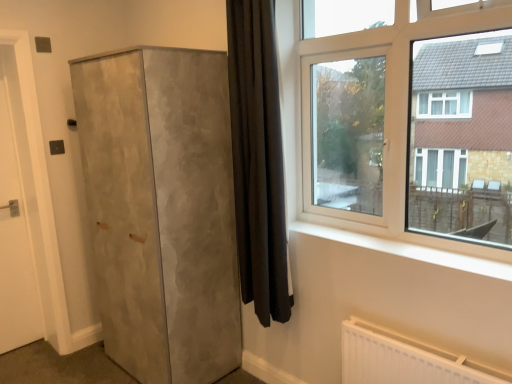
Question: Considering the relative sizes of white matte door at left and matte concrete cupboard at left in the image provided, is white matte door at left thinner than matte concrete cupboard at left?

Choices:
 (A) no
 (B) yes

Answer: (B)

Question: Is white matte door at left to the left of matte concrete cupboard at left from the viewer's perspective?

Choices:
 (A) yes
 (B) no

Answer: (A)

Question: Considering the relative sizes of white matte door at left and matte concrete cupboard at left in the image provided, is white matte door at left shorter than matte concrete cupboard at left?

Choices:
 (A) yes
 (B) no

Answer: (B)

Question: Does white matte door at left lie in front of matte concrete cupboard at left?

Choices:
 (A) yes
 (B) no

Answer: (B)

Question: From a real-world perspective, is white matte door at left below matte concrete cupboard at left?

Choices:
 (A) yes
 (B) no

Answer: (B)

Question: From the image's perspective, is matte concrete cupboard at left above or below black velvet curtain at center?

Choices:
 (A) below
 (B) above

Answer: (A)

Question: Is matte concrete cupboard at left to the left or to the right of black velvet curtain at center in the image?

Choices:
 (A) right
 (B) left

Answer: (B)

Question: Considering their positions, is matte concrete cupboard at left located in front of or behind black velvet curtain at center?

Choices:
 (A) behind
 (B) front

Answer: (A)

Question: In terms of width, does matte concrete cupboard at left look wider or thinner when compared to black velvet curtain at center?

Choices:
 (A) wide
 (B) thin

Answer: (A)

Question: Based on their sizes in the image, would you say matte concrete cupboard at left is bigger or smaller than clear glass window at upper right?

Choices:
 (A) big
 (B) small

Answer: (A)

Question: From the image's perspective, is matte concrete cupboard at left above or below clear glass window at upper right?

Choices:
 (A) below
 (B) above

Answer: (A)

Question: In the image, is matte concrete cupboard at left positioned in front of or behind clear glass window at upper right?

Choices:
 (A) behind
 (B) front

Answer: (A)

Question: From a real-world perspective, is matte concrete cupboard at left physically located above or below clear glass window at upper right?

Choices:
 (A) above
 (B) below

Answer: (B)

Question: From the image's perspective, relative to white matte door at left, is black velvet curtain at center above or below?

Choices:
 (A) above
 (B) below

Answer: (A)

Question: Relative to white matte door at left, is black velvet curtain at center in front or behind?

Choices:
 (A) front
 (B) behind

Answer: (A)